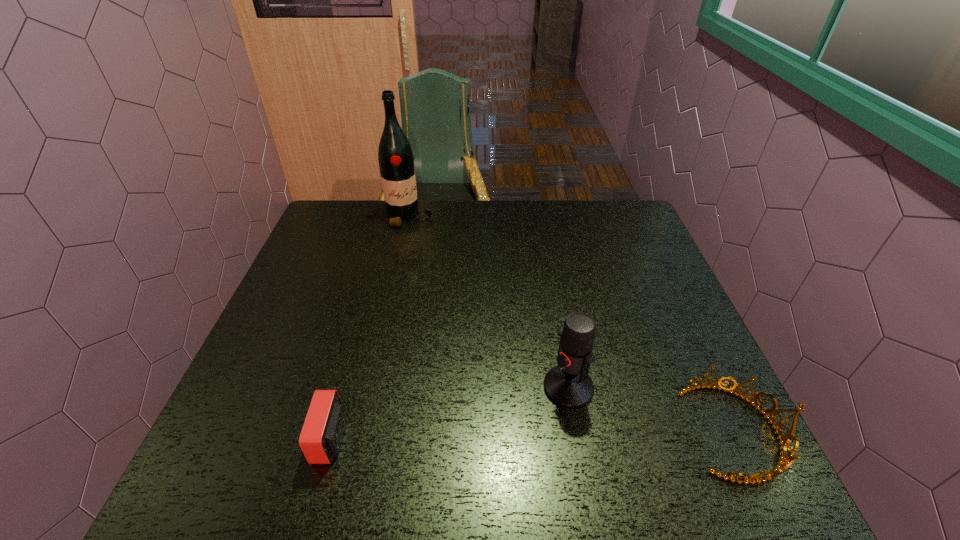
This screenshot has height=540, width=960. I want to click on empty space that is in between the third object from left to right and the alarm clock, so click(449, 413).

Find the location of a particular element. free space between the tiara and the second tallest object is located at coordinates (653, 409).

At what (x,y) coordinates should I click in order to perform the action: click on unoccupied area between the rightmost object and the alarm clock. Please return your answer as a coordinate pair (x, y). Looking at the image, I should click on (535, 435).

You are a GUI agent. You are given a task and a screenshot of the screen. Output one action in this format:
    pyautogui.click(x=<x>, y=<y>)
    Task: Click on the empty space between the rightmost object and the alarm clock
    This screenshot has width=960, height=540.
    Given the screenshot: What is the action you would take?
    pyautogui.click(x=535, y=435)

Image resolution: width=960 pixels, height=540 pixels. Identify the location of unoccupied area between the wine bottle and the alarm clock. (371, 327).

This screenshot has width=960, height=540. I want to click on unoccupied position between the rightmost object and the third shortest object, so click(x=653, y=409).

I want to click on object that is the second closest to the farthest object, so click(321, 437).

Locate an element on the screen. The image size is (960, 540). object that is the closest to the wine bottle is located at coordinates (568, 385).